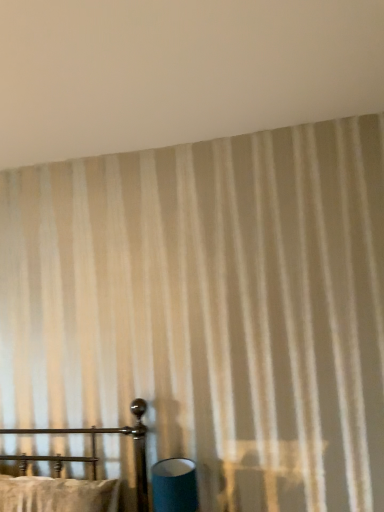
Question: From the image's perspective, relative to metal bed frame at lower left, is matte blue cylinder at lower center above or below?

Choices:
 (A) below
 (B) above

Answer: (A)

Question: In terms of width, does matte blue cylinder at lower center look wider or thinner when compared to metal bed frame at lower left?

Choices:
 (A) wide
 (B) thin

Answer: (B)

Question: Which of these objects is positioned closest to the metal bed frame at lower left?

Choices:
 (A) matte blue cylinder at lower center
 (B) beige striped curtain at upper center

Answer: (A)

Question: Which of these objects is positioned closest to the beige striped curtain at upper center?

Choices:
 (A) matte blue cylinder at lower center
 (B) metal bed frame at lower left

Answer: (B)